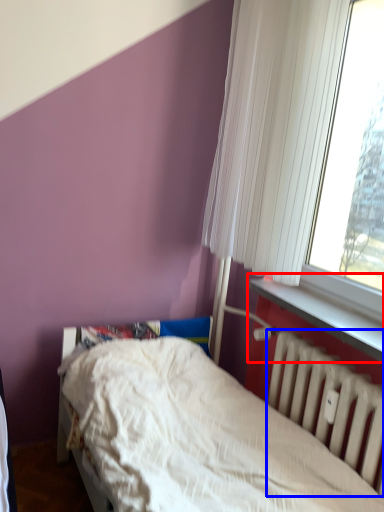
Question: Which object appears closest to the camera in this image, window sill (highlighted by a red box) or radiator (highlighted by a blue box)?

Choices:
 (A) window sill
 (B) radiator

Answer: (B)